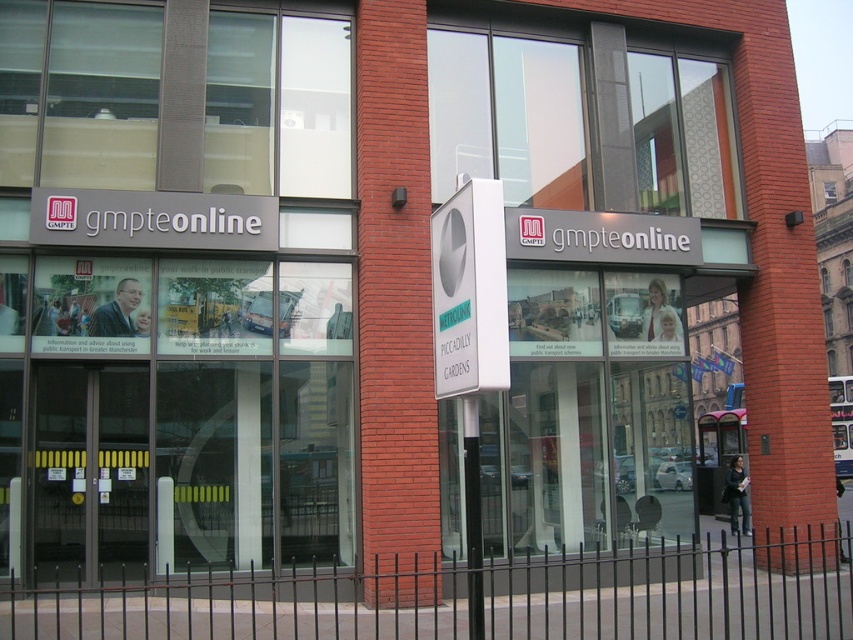
Question: Can you confirm if white plastic sign at center is wider than black plastic pole at center?

Choices:
 (A) yes
 (B) no

Answer: (A)

Question: Does white plastic sign at center have a lesser width compared to black plastic pole at center?

Choices:
 (A) yes
 (B) no

Answer: (B)

Question: Can you confirm if white plastic sign at center is positioned to the right of black plastic pole at center?

Choices:
 (A) no
 (B) yes

Answer: (A)

Question: Which object is closer to the camera taking this photo?

Choices:
 (A) white plastic sign at center
 (B) black plastic pole at center

Answer: (A)